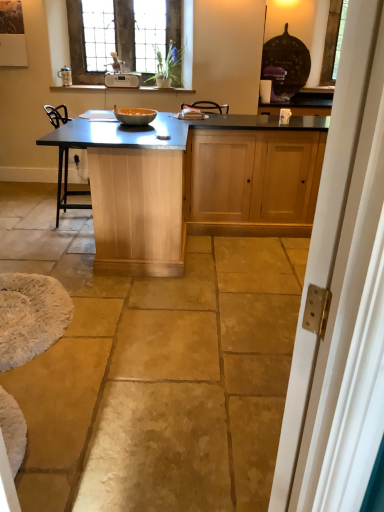
Where is `blank space to the left of matte wood table at center`? blank space to the left of matte wood table at center is located at coordinates (36, 229).